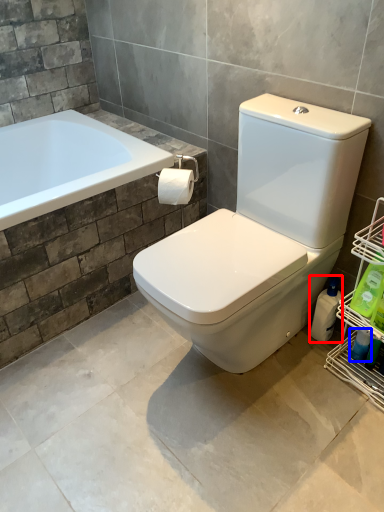
Question: Which point is closer to the camera, cleaning product (highlighted by a red box) or cleaning product (highlighted by a blue box)?

Choices:
 (A) cleaning product
 (B) cleaning product

Answer: (B)